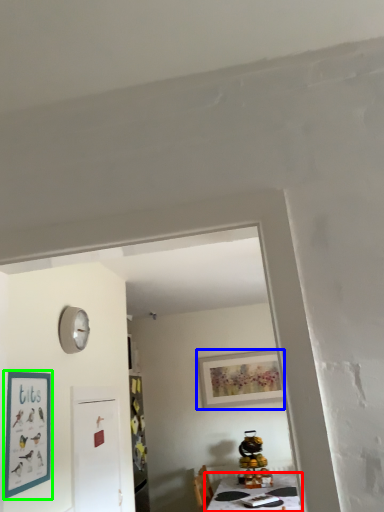
Question: Which is farther away from table (highlighted by a red box)? picture frame (highlighted by a blue box) or picture frame (highlighted by a green box)?

Choices:
 (A) picture frame
 (B) picture frame

Answer: (B)